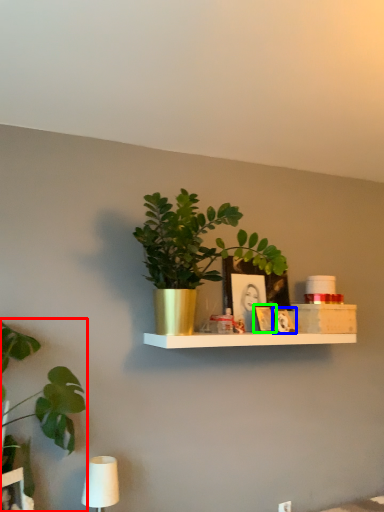
Question: Considering the real-world distances, which object is farthest from houseplant (highlighted by a red box)? picture frame (highlighted by a blue box) or picture frame (highlighted by a green box)?

Choices:
 (A) picture frame
 (B) picture frame

Answer: (A)